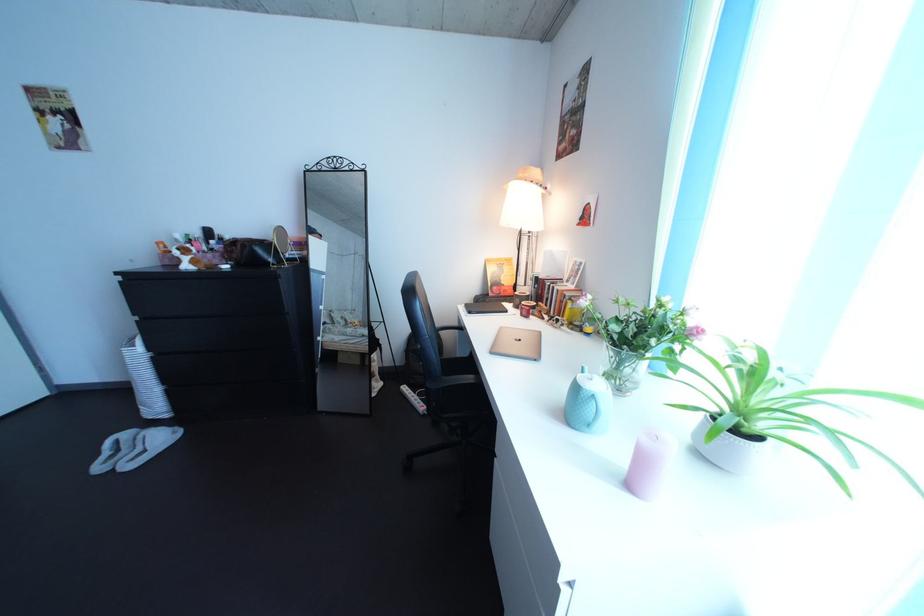
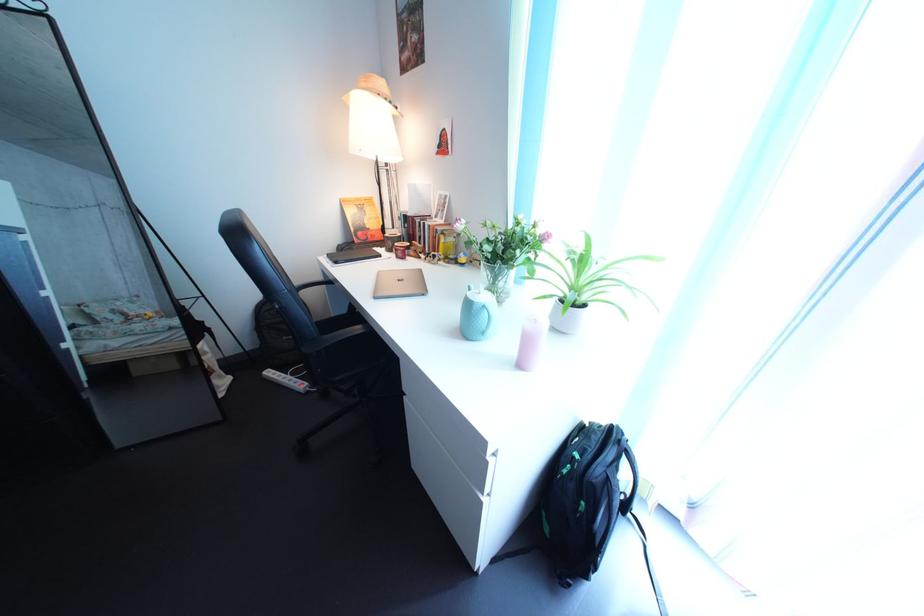
The point at [526,325] is marked in the first image. Where is the corresponding point in the second image?

(402, 269)